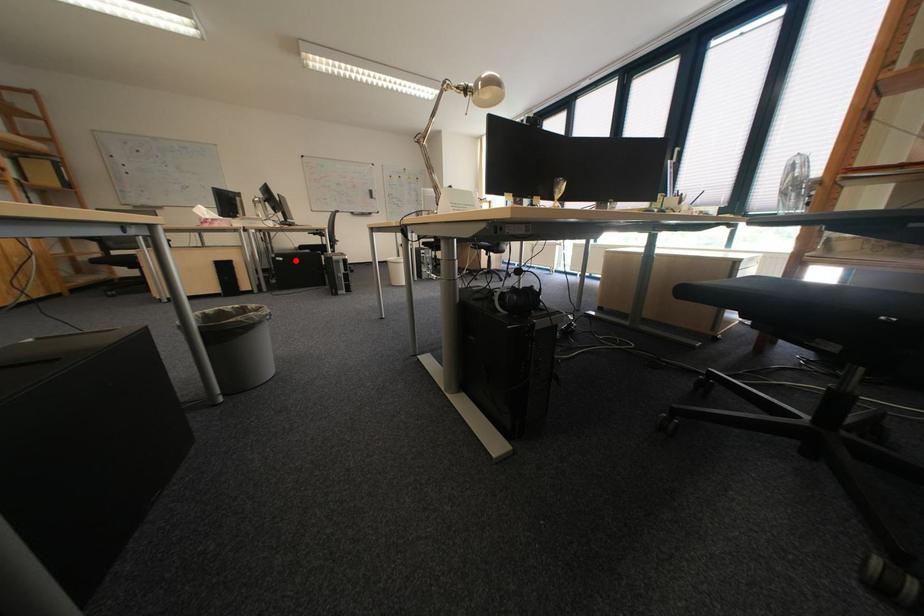
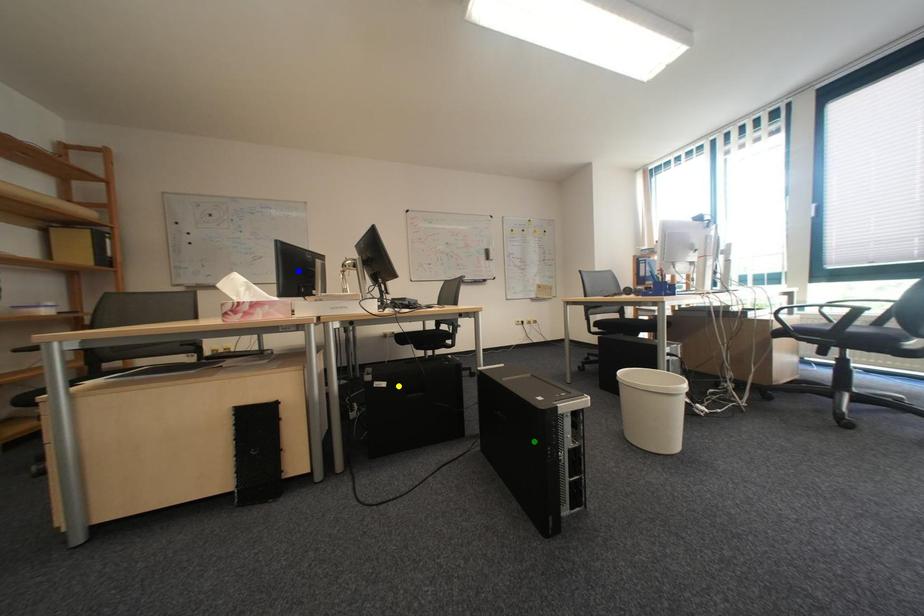
Question: I am providing you with two images of the same scene from different viewpoints. A red point is marked on the first image. You are given multiple points on the second image. Which point in image 2 is actually the same real-world point as the red point in image 1?

Choices:
 (A) yellow point
 (B) green point
 (C) blue point

Answer: (A)